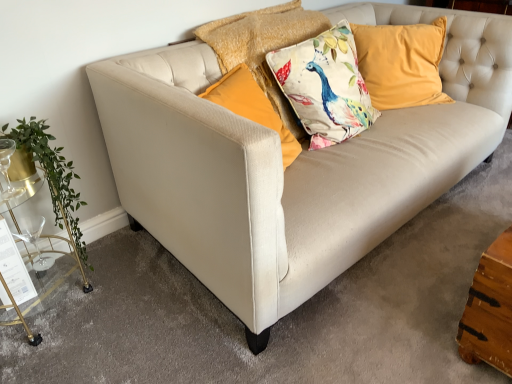
Question: Considering their positions, is floral fabric cushion at center, acting as the 1th pillow starting from the left, located in front of or behind gold metallic bar cart at left?

Choices:
 (A) behind
 (B) front

Answer: (A)

Question: From a real-world perspective, is floral fabric cushion at center, acting as the 1th pillow starting from the left, physically located above or below gold metallic bar cart at left?

Choices:
 (A) below
 (B) above

Answer: (B)

Question: Which of these objects is positioned farthest from the green leafy plant at left?

Choices:
 (A) clear glass wine glass at lower left
 (B) floral fabric cushion at center, acting as the 1th pillow starting from the left
 (C) velvet yellow pillow at upper right, acting as the first pillow starting from the right
 (D) gold metallic bar cart at left

Answer: (C)

Question: Estimate the real-world distances between objects in this image. Which object is farther from the floral fabric cushion at center, arranged as the second pillow when viewed from the right?

Choices:
 (A) velvet yellow pillow at upper right, the second pillow when ordered from left to right
 (B) clear glass wine glass at lower left
 (C) gold metallic bar cart at left
 (D) green leafy plant at left

Answer: (B)